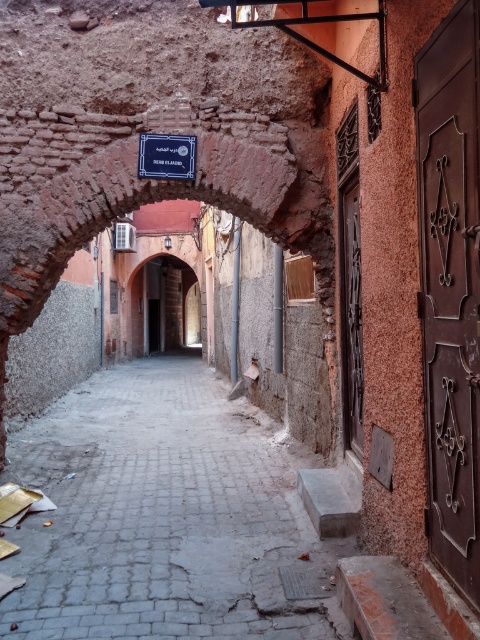
You are a delivery person trying to navigate through the gray concrete alley at center and the rustic stone archway at center. Which object is positioned lower from the ground?

The gray concrete alley at center is positioned lower from the ground than the rustic stone archway at center.

You are a delivery person carrying a package that requires passing under an archway. You see the rustic stone archway at center and the blue metallic sign at center. Which one has a higher clearance for your package?

The rustic stone archway at center has a greater height compared to the blue metallic sign at center, so the rustic stone archway at center provides higher clearance for your package.

You are standing in the alleyway and want to walk towards the two points marked in the scene. Which point, point (266, 544) or point (158, 300), will you reach first?

You will reach point (266, 544) first because it is closer to you than point (158, 300).